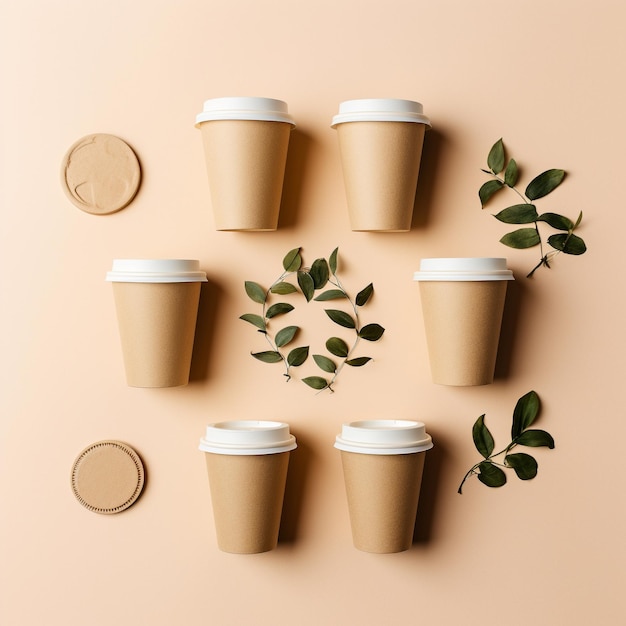
In order to click on cups next to another cup in this screenshot , I will do `click(177, 307)`, `click(260, 443)`, `click(376, 483)`, `click(469, 327)`, `click(384, 181)`, `click(233, 190)`.